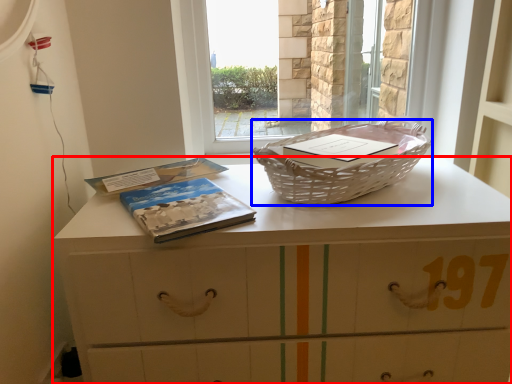
Question: Which point is closer to the camera, chest of drawers (highlighted by a red box) or picnic basket (highlighted by a blue box)?

Choices:
 (A) chest of drawers
 (B) picnic basket

Answer: (A)